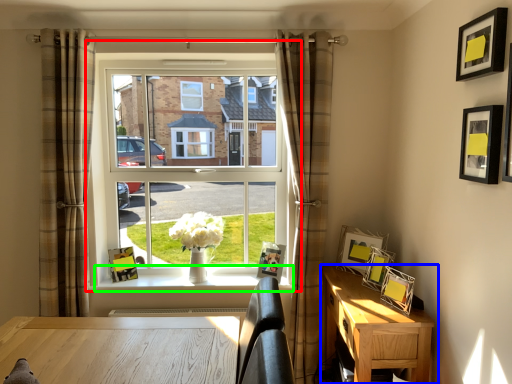
Question: Which object is positioned closest to window (highlighted by a red box)? Select from nightstand (highlighted by a blue box) and window sill (highlighted by a green box).

Choices:
 (A) nightstand
 (B) window sill

Answer: (B)